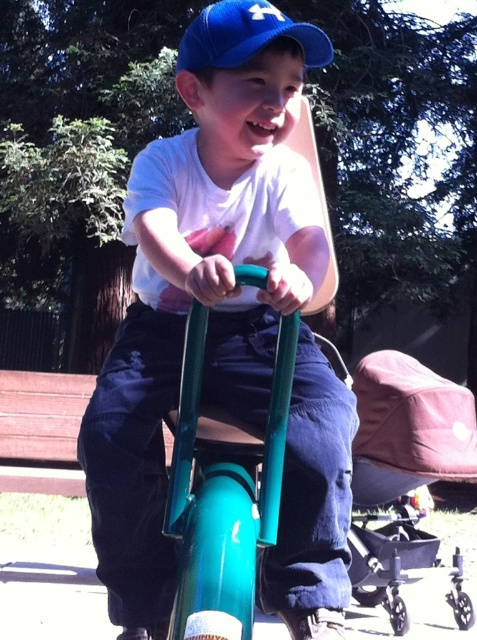
You are standing at the point labeled as point [169,182] and want to walk towards the point labeled as point [404,529]. Based on the scene description, will you be moving away from or towards the green seesaw?

Since point [169,182] is in front of point [404,529], moving from point [169,182] towards point [404,529] means you are moving away from the green seesaw.

You are a photographer trying to capture the boy on the seesaw. You notice two caps on the ground near the seesaw. The matte blue cap at upper center and the blue fabric cap at upper center. Which one is positioned to the left when looking from your perspective?

The matte blue cap at upper center is to the left of the blue fabric cap at upper center.

You are a parent trying to decide where to place your child. You have a black plastic stroller at lower right and a blue fabric cap at upper center in the image. Which object takes up more space?

The black plastic stroller at lower right is larger in size than the blue fabric cap at upper center, so it takes up more space.